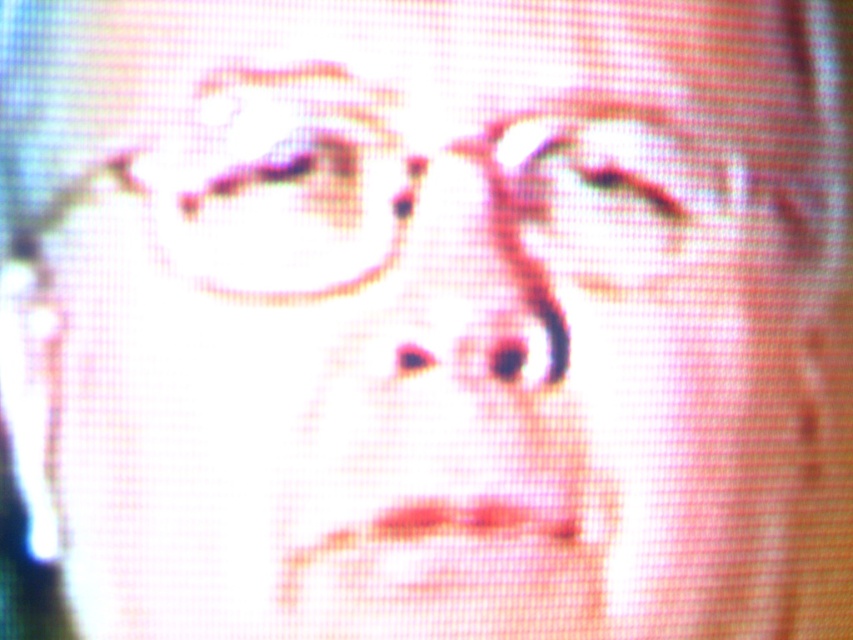
You are an AI analyzing facial features in a low resolution image. You see a point at coordinates (418,216). What object is located at that point?

The matte plastic glasses at center is located at point (418,216).

You are a photographer trying to edit this image. You want to adjust the lighting to make the matte pink eyebrow at upper center more visible without affecting the matte plastic glasses at center. Is this possible given their current positions?

The matte plastic glasses at center is in front of the matte pink eyebrow at upper center, so adjusting the lighting to make the matte pink eyebrow at upper center more visible without affecting the matte plastic glasses at center may not be possible since the glasses are blocking part of the eyebrow.

You are a photographer trying to adjust the lighting for a portrait. You notice the matte plastic glasses at center and the matte pink eyebrow at upper center in the image. Which object is positioned lower on the face?

The matte plastic glasses at center is below matte pink eyebrow at upper center, so the glasses are positioned lower on the face.